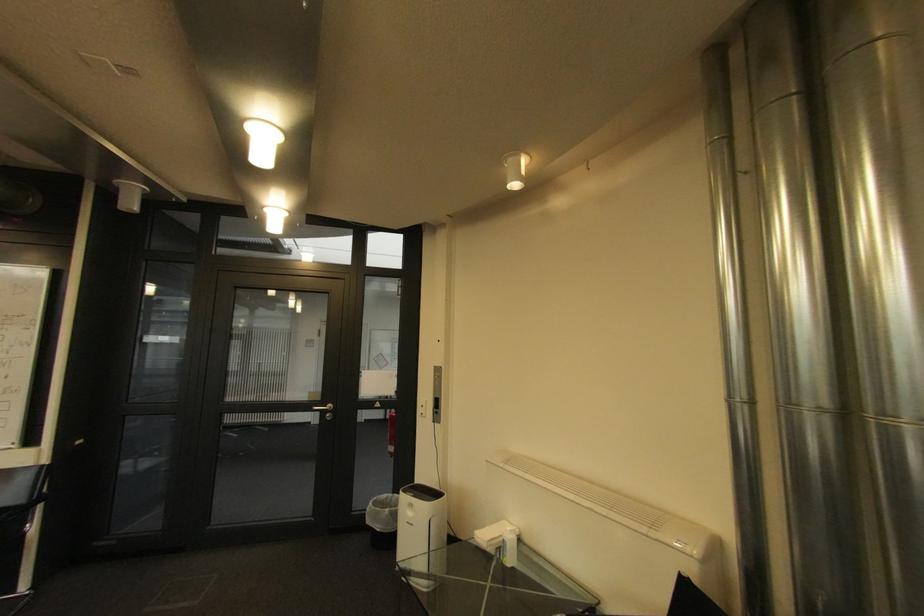
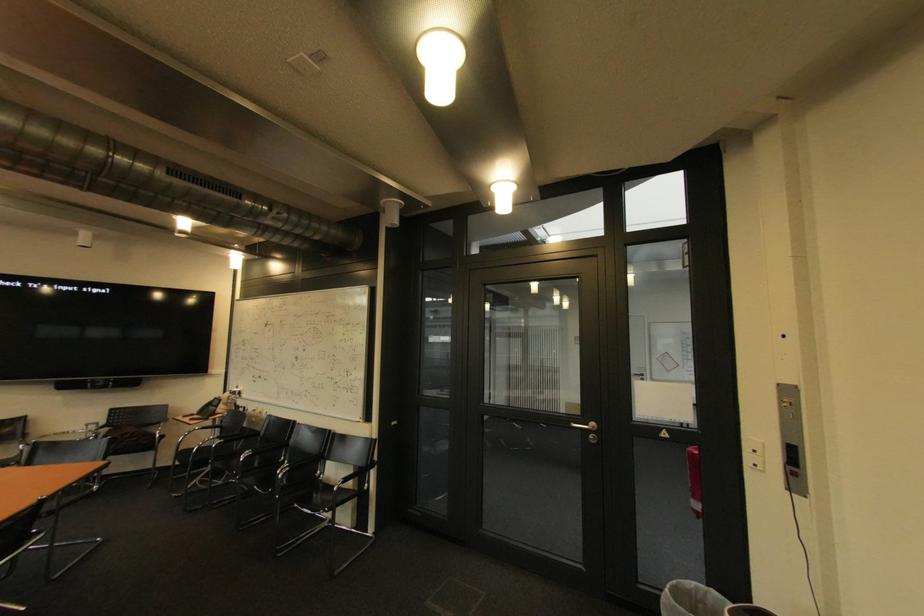
Find the pixel in the second image that matches the point at 394,496 in the first image.

(701, 585)